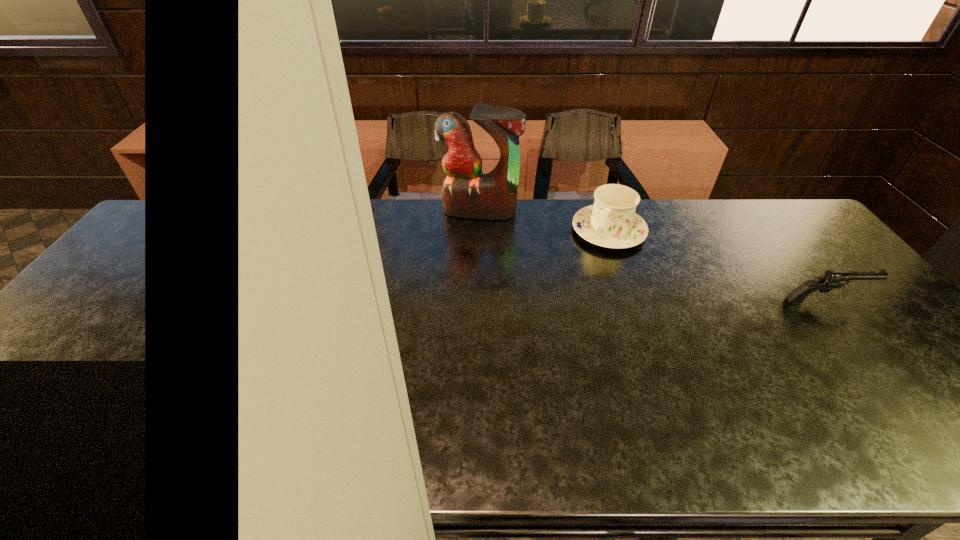
This screenshot has height=540, width=960. What are the coordinates of `free space between the shortest object and the second object from right to left` in the screenshot? It's located at (717, 266).

The image size is (960, 540). Find the location of `free space between the chinaware and the nearest object`. free space between the chinaware and the nearest object is located at coordinates (717, 266).

Locate an element on the screen. the closest object to the leftmost object is located at coordinates (611, 222).

I want to click on object that is the closest to the shortest object, so click(x=611, y=222).